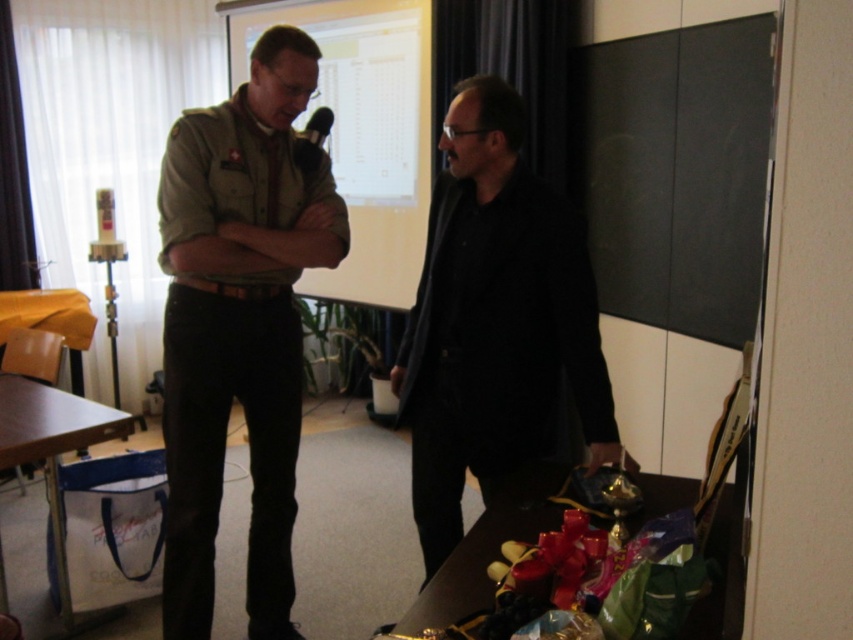
Question: Is shiny metallic table at lower right to the right of light brown wooden table at lower left from the viewer's perspective?

Choices:
 (A) no
 (B) yes

Answer: (B)

Question: Which of the following is the farthest from the observer?

Choices:
 (A) (320, 140)
 (B) (730, 561)
 (C) (283, 84)

Answer: (A)

Question: Among these points, which one is nearest to the camera?

Choices:
 (A) (514, 538)
 (B) (56, 481)

Answer: (A)

Question: Does satin khaki shirt at center have a larger size compared to black matte jacket at center?

Choices:
 (A) yes
 (B) no

Answer: (A)

Question: Which point is closer to the camera taking this photo?

Choices:
 (A) (558, 241)
 (B) (297, 436)

Answer: (A)

Question: Does light brown wooden table at lower left appear on the left side of metallic silver microphone at upper center?

Choices:
 (A) yes
 (B) no

Answer: (A)